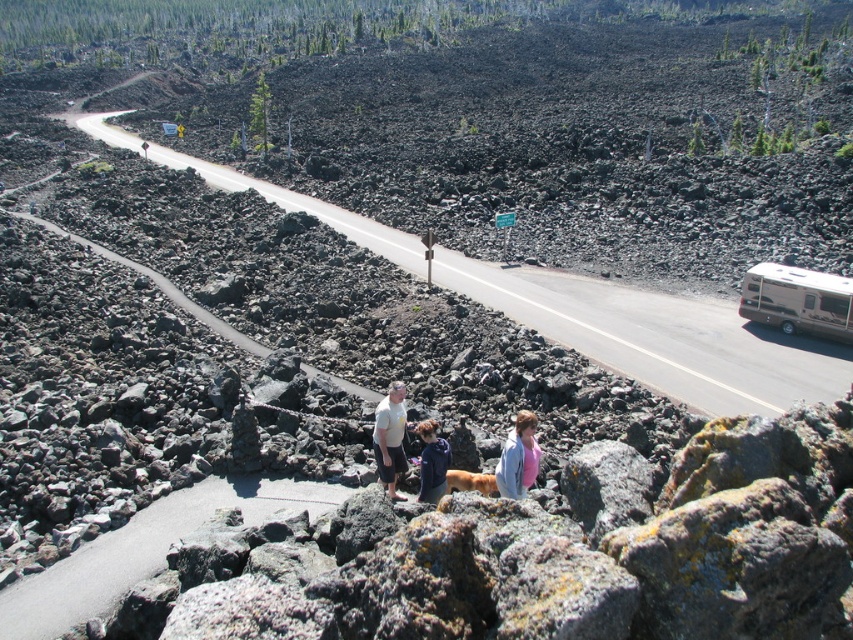
Does point (834, 308) lie in front of point (424, 472)?

No, (834, 308) is further to viewer.

Can you confirm if beige metallic tour bus at right is positioned above dark blue jacket at center?

Yes, beige metallic tour bus at right is above dark blue jacket at center.

Who is more forward, (x=805, y=280) or (x=421, y=435)?

Point (x=421, y=435) is in front.

At what (x,y) coordinates should I click in order to perform the action: click on beige metallic tour bus at right. Please return your answer as a coordinate pair (x, y). The width and height of the screenshot is (853, 640). Looking at the image, I should click on (798, 300).

Based on the photo, does beige metallic tour bus at right lie in front of light blue denim jacket at center?

No, it is behind light blue denim jacket at center.

Is point (799, 298) positioned before point (524, 480)?

No, (799, 298) is behind (524, 480).

This screenshot has height=640, width=853. Find the location of `beige metallic tour bus at right`. beige metallic tour bus at right is located at coordinates (798, 300).

Find the location of a particular element. The image size is (853, 640). asphalt road at center is located at coordinates (659, 337).

Based on the photo, measure the distance between point (782, 362) and camera.

Point (782, 362) is 23.90 meters from camera.

Is point (529, 275) farther from viewer compared to point (769, 262)?

Yes, it is.

This screenshot has height=640, width=853. I want to click on asphalt road at center, so click(x=659, y=337).